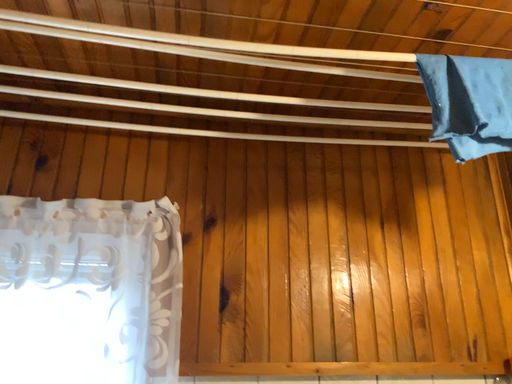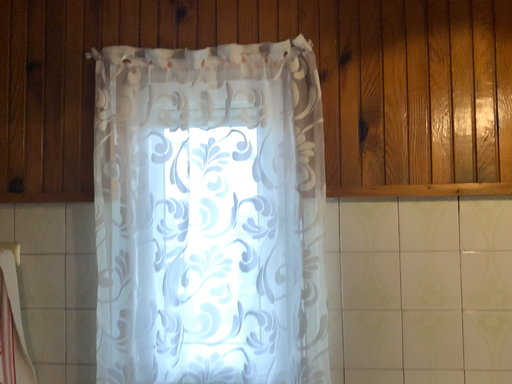
Question: Which way did the camera rotate in the video?

Choices:
 (A) rotated left
 (B) rotated right

Answer: (A)